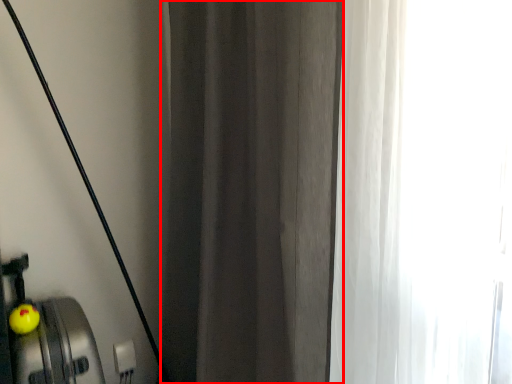
Question: From the image, what is the correct spatial relationship of curtain (annotated by the red box) in relation to apple?

Choices:
 (A) right
 (B) left

Answer: (A)